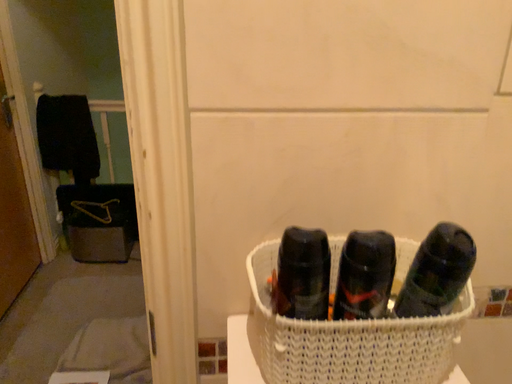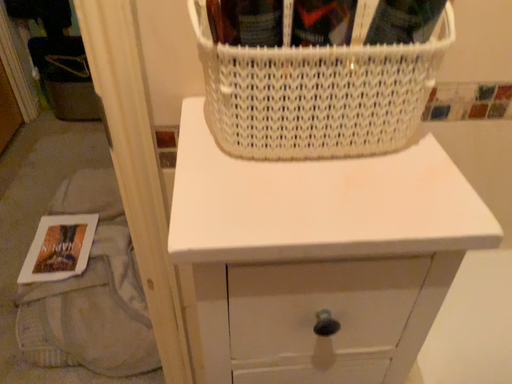
Question: Which way did the camera rotate in the video?

Choices:
 (A) rotated upward
 (B) rotated downward

Answer: (B)